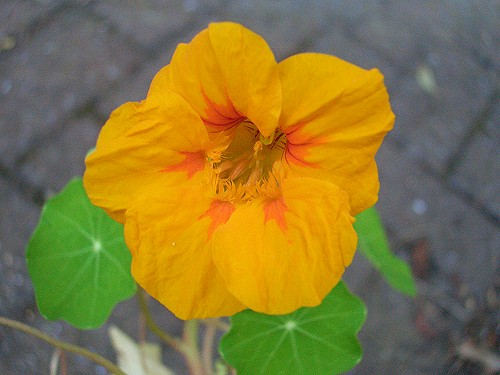
What are the coordinates of `1 flower` in the screenshot? It's located at (326, 140).